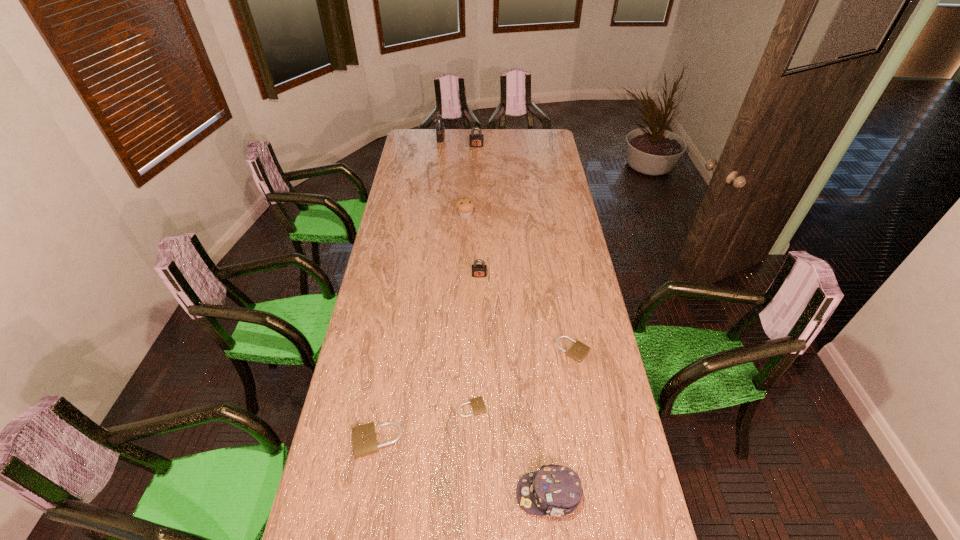
I want to click on vacant area situated on the front-facing side of the headwear, so click(x=499, y=495).

The image size is (960, 540). Identify the location of free space located 0.380m on the back of the fourth tallest padlock. (396, 329).

In order to click on free point located on the front of the second shortest padlock in this screenshot , I will do click(587, 424).

What are the coordinates of `vacant region located on the front of the second beige padlock from left to right` in the screenshot? It's located at (471, 478).

Locate an element on the screen. This screenshot has width=960, height=540. object at the left edge is located at coordinates (364, 437).

Find the location of a particular element. object that is at the right edge is located at coordinates (579, 350).

In the image, there is a desktop. Identify the location of free space at the far edge. (454, 141).

Find the location of a particular element. This screenshot has width=960, height=540. free space at the left edge of the desktop is located at coordinates (341, 401).

Where is `free space at the right edge of the desktop`? The width and height of the screenshot is (960, 540). free space at the right edge of the desktop is located at coordinates (590, 470).

I want to click on free space at the far right corner of the desktop, so click(x=550, y=139).